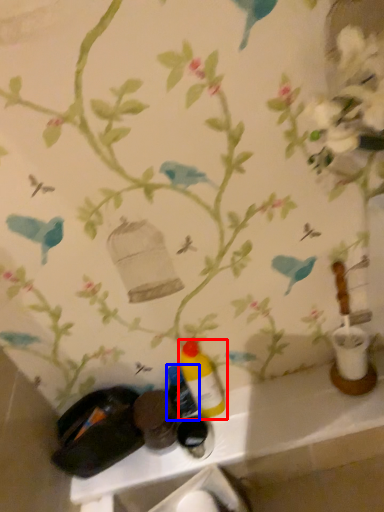
Question: Which of the following is the farthest to the observer, bottle (highlighted by a red box) or bottle (highlighted by a blue box)?

Choices:
 (A) bottle
 (B) bottle

Answer: (B)